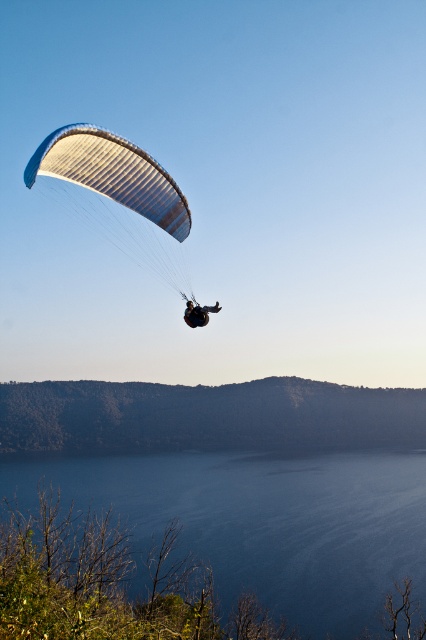
You are a paraglider pilot preparing to land. You see the brown textured hillside at lower center. Based on its position coordinates, can you determine if it is a suitable landing spot?

The brown textured hillside at lower center is located at coordinates point (204, 417), which is a suitable landing spot for the paraglider pilot.